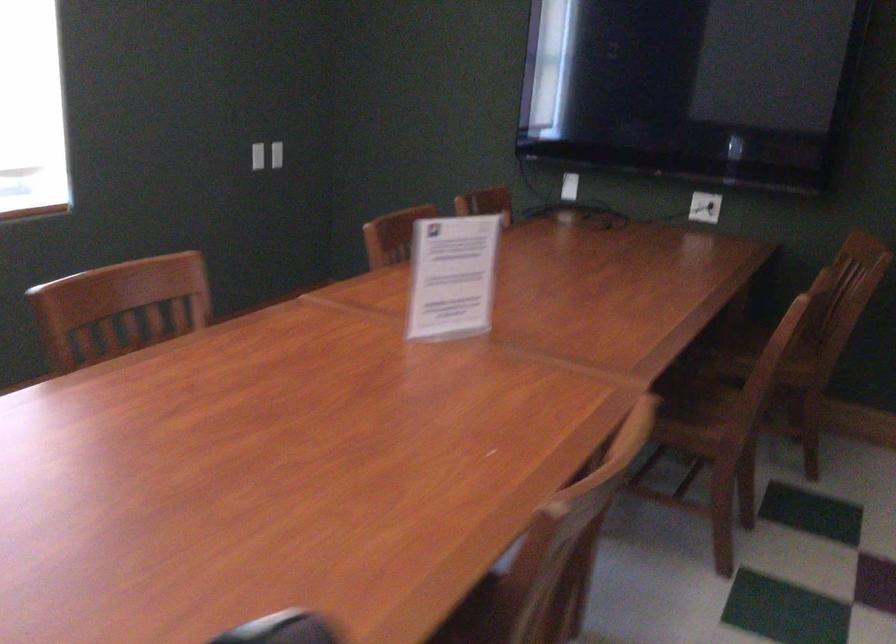
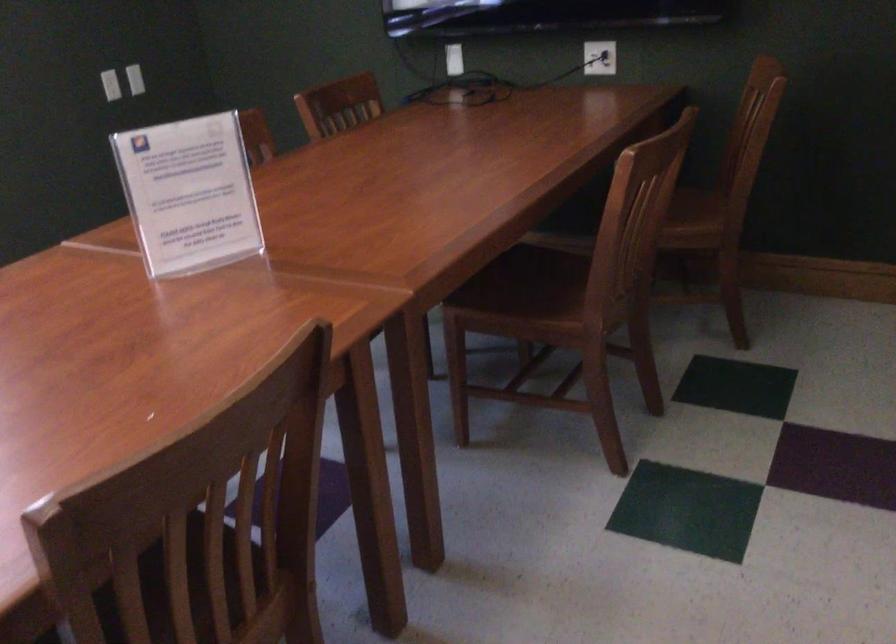
Question: The first image is from the beginning of the video and the second image is from the end. How did the camera likely rotate when shooting the video?

Choices:
 (A) Left
 (B) Right
 (C) Up
 (D) Down

Answer: (D)